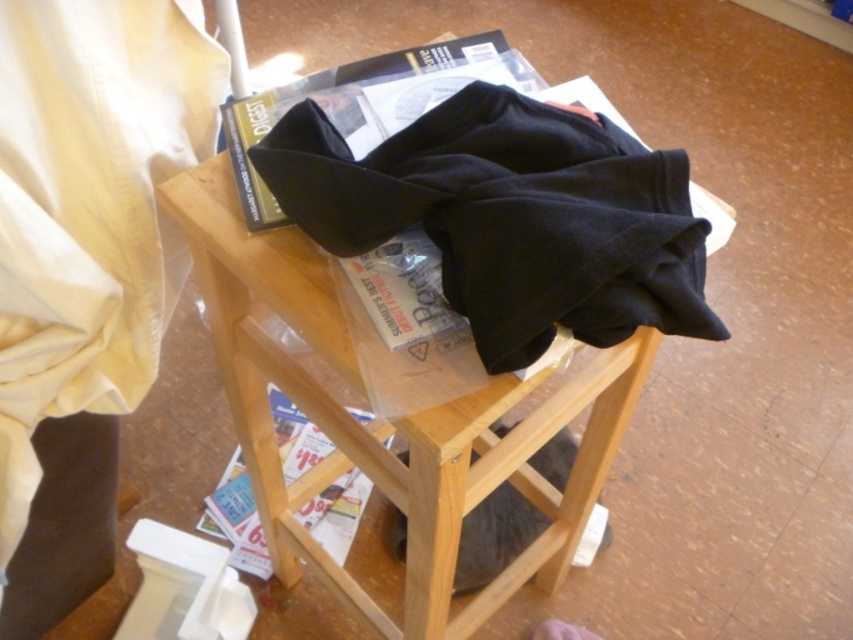
Question: Which of these objects is positioned closest to the printed paper magazine at lower center?

Choices:
 (A) matte black magazine at center
 (B) black cotton blanket at center

Answer: (A)

Question: Observing the image, what is the correct spatial positioning of matte black magazine at center in reference to printed paper magazine at lower center?

Choices:
 (A) left
 (B) right

Answer: (B)

Question: Can you confirm if matte black magazine at center is smaller than printed paper magazine at lower center?

Choices:
 (A) no
 (B) yes

Answer: (B)

Question: Which of these objects is positioned farthest from the matte black magazine at center?

Choices:
 (A) printed paper magazine at lower center
 (B) wooden stool at center

Answer: (A)

Question: Does black cotton blanket at center appear on the left side of wooden stool at center?

Choices:
 (A) no
 (B) yes

Answer: (A)

Question: Which of the following is the farthest from the observer?

Choices:
 (A) black cotton blanket at center
 (B) matte black magazine at center
 (C) printed paper magazine at lower center
 (D) wooden stool at center

Answer: (C)